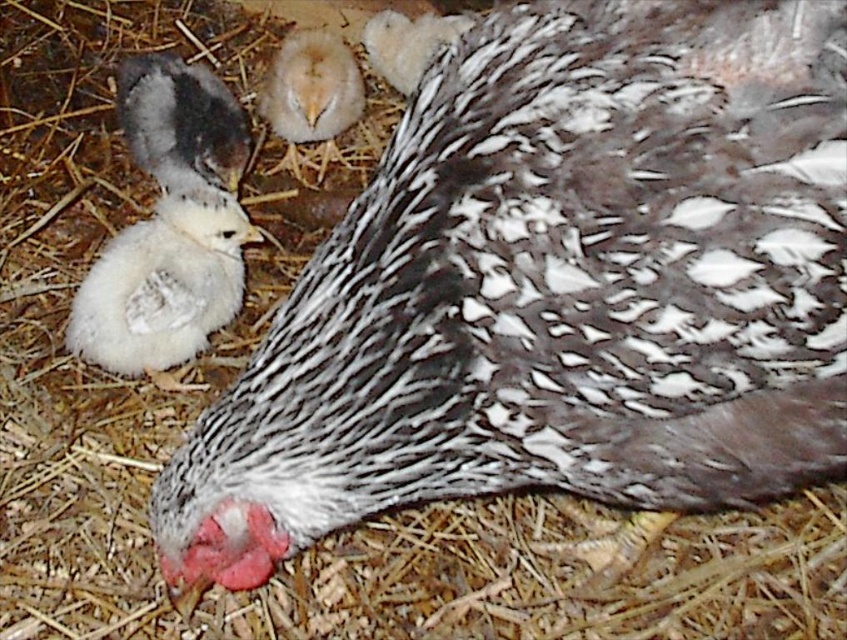
Question: Is white fluffy chick at left thinner than speckled feathered chicken at center?

Choices:
 (A) yes
 (B) no

Answer: (B)

Question: Which object is the farthest from the white fluffy chick at left?

Choices:
 (A) speckled feathered chicken at center
 (B) light yellow down at center

Answer: (A)

Question: In this image, where is light yellow down at center located relative to speckled feathered chicken at center?

Choices:
 (A) above
 (B) below

Answer: (B)

Question: Is white fluffy chick at left smaller than speckled feathered chicken at center?

Choices:
 (A) yes
 (B) no

Answer: (B)

Question: Which point is closer to the camera?

Choices:
 (A) (70, 332)
 (B) (275, 83)

Answer: (A)

Question: Estimate the real-world distances between objects in this image. Which object is farther from the white fluffy chick at left?

Choices:
 (A) speckled feathered chicken at center
 (B) light yellow down at center

Answer: (A)